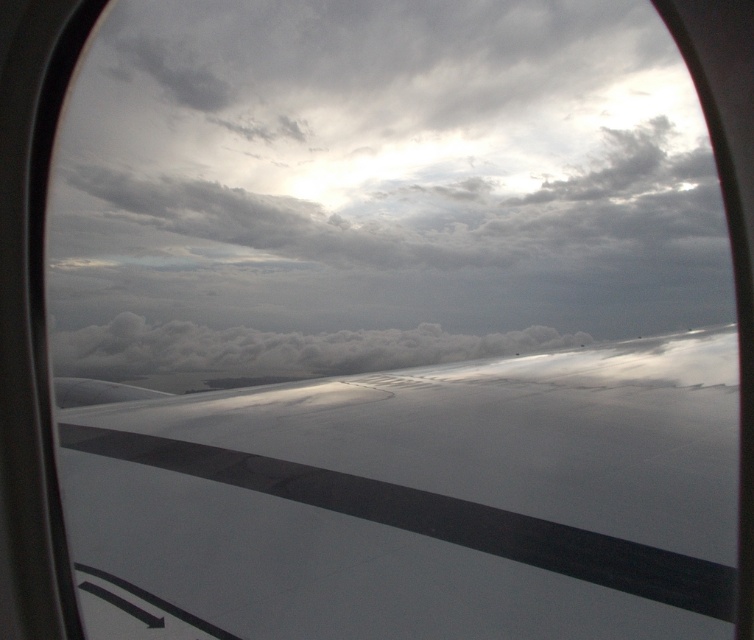
Question: Is white glossy wing at center smaller than white fluffy cloud at center?

Choices:
 (A) no
 (B) yes

Answer: (B)

Question: Can you confirm if white glossy wing at center is wider than white fluffy cloud at center?

Choices:
 (A) yes
 (B) no

Answer: (B)

Question: Which object appears closest to the camera in this image?

Choices:
 (A) white glossy wing at center
 (B) white fluffy cloud at center

Answer: (A)

Question: Does white glossy wing at center appear over white fluffy cloud at center?

Choices:
 (A) yes
 (B) no

Answer: (B)